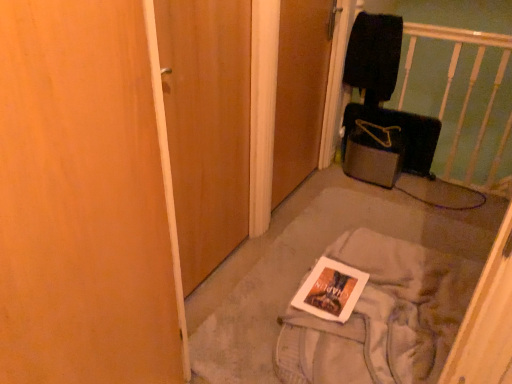
Identify the location of empty space that is in between wooden door at center, which is the 2th door in left-to-right order, and white fabric book at center. Image resolution: width=512 pixels, height=384 pixels. (359, 193).